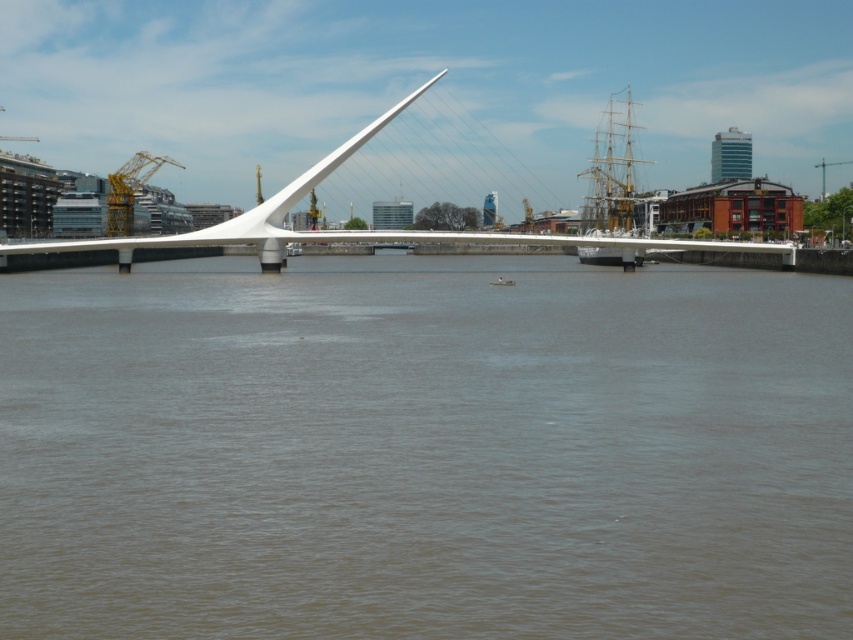
Does brown matte water at center have a smaller size compared to yellow metallic crane at upper left?

Yes, brown matte water at center is smaller than yellow metallic crane at upper left.

Is brown matte water at center thinner than yellow metallic crane at upper left?

Incorrect, brown matte water at center's width is not less than yellow metallic crane at upper left's.

Locate an element on the screen. This screenshot has height=640, width=853. brown matte water at center is located at coordinates (424, 451).

Identify the location of wooden ship at right. (616, 182).

Between wooden ship at right and yellow metallic crane at upper left, which one has more height?

With more height is wooden ship at right.

Does point (621, 138) lie behind point (126, 170)?

No, (621, 138) is closer to viewer.

Locate an element on the screen. This screenshot has width=853, height=640. wooden ship at right is located at coordinates (616, 182).

Who is shorter, brown matte water at center or wooden ship at right?

With less height is brown matte water at center.

Can you confirm if brown matte water at center is shorter than wooden ship at right?

Indeed, brown matte water at center has a lesser height compared to wooden ship at right.

Where is `brown matte water at center`? brown matte water at center is located at coordinates (424, 451).